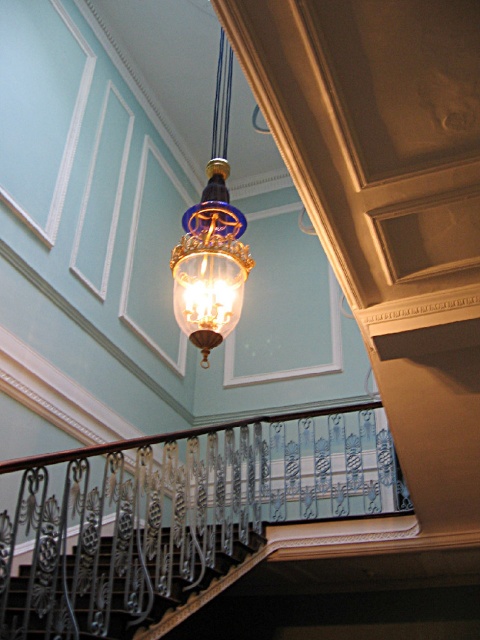
Question: Which point is closer to the camera?

Choices:
 (A) black wrought iron railing at lower left
 (B) translucent glass lamp at center

Answer: (A)

Question: Among these objects, which one is nearest to the camera?

Choices:
 (A) black wrought iron railing at lower left
 (B) translucent glass lamp at center
 (C) black wrought iron railing at center

Answer: (A)

Question: Does translucent glass lamp at center have a smaller size compared to black wrought iron railing at lower left?

Choices:
 (A) yes
 (B) no

Answer: (A)

Question: Is black wrought iron railing at center to the left of translucent glass lamp at center from the viewer's perspective?

Choices:
 (A) yes
 (B) no

Answer: (A)

Question: Which point is farther from the camera taking this photo?

Choices:
 (A) (192, 314)
 (B) (73, 552)
 (C) (128, 476)

Answer: (C)

Question: Is black wrought iron railing at center in front of black wrought iron railing at lower left?

Choices:
 (A) no
 (B) yes

Answer: (A)